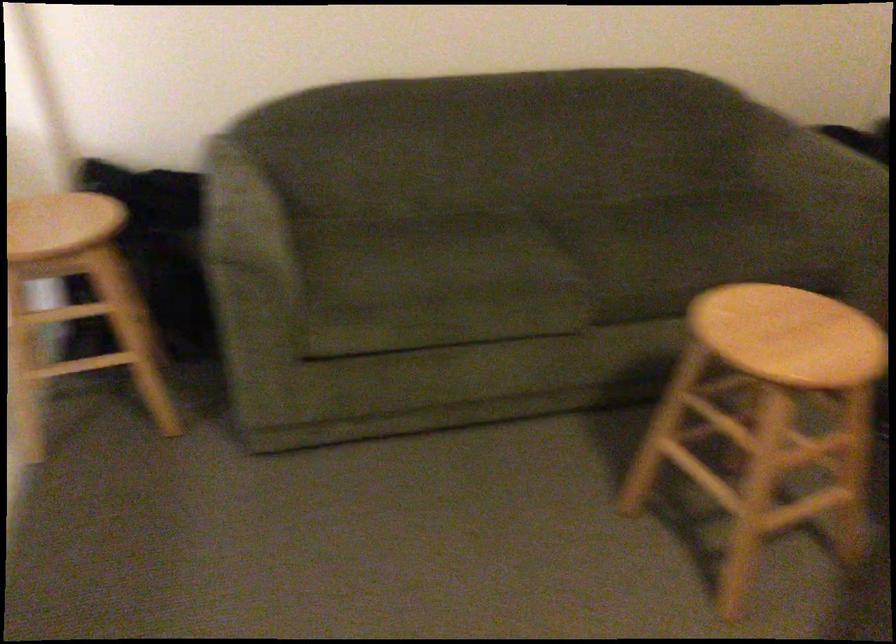
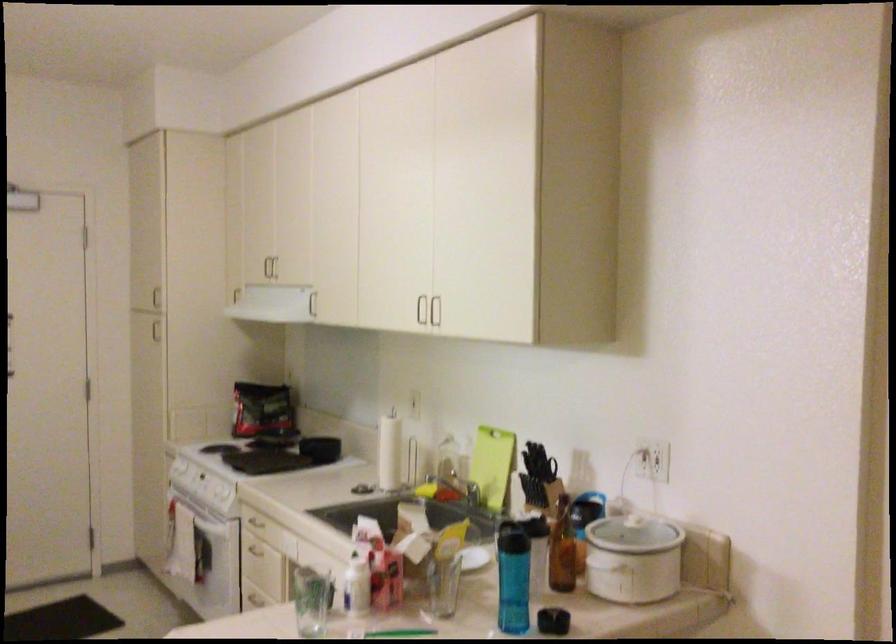
Question: The first image is from the beginning of the video and the second image is from the end. How did the camera likely rotate when shooting the video?

Choices:
 (A) Left
 (B) Right
 (C) Up
 (D) Down

Answer: (A)